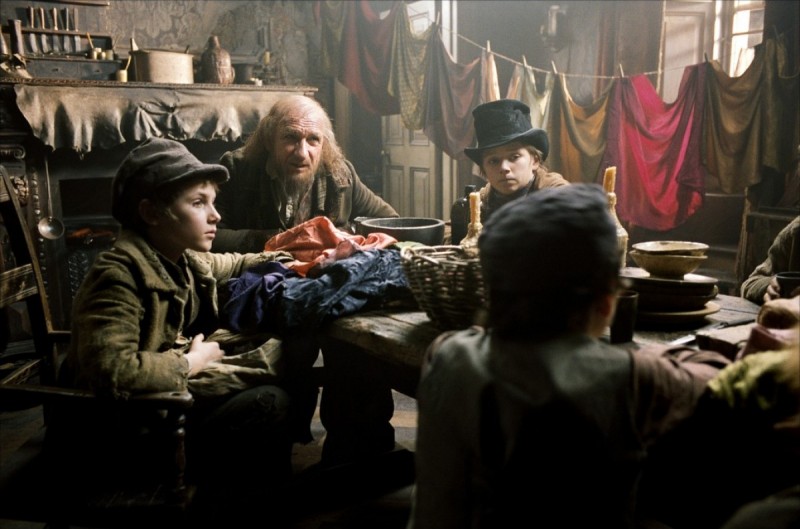
Locate an element on the screen. table is located at coordinates (394, 329).